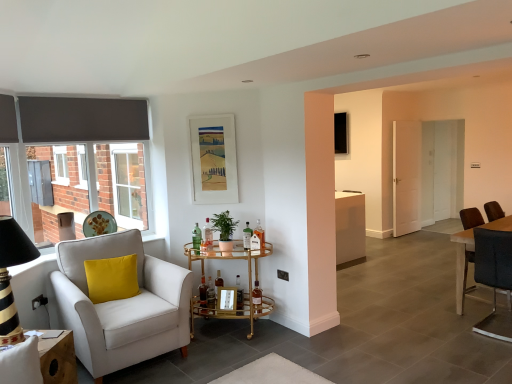
Question: From the image's perspective, is translucent glass bottle at center, the third bottle viewed from the right, below translucent glass bottle at center, marked as the second bottle in a left-to-right arrangement?

Choices:
 (A) no
 (B) yes

Answer: (A)

Question: Is translucent glass bottle at center, positioned as the seventh bottle in left-to-right order, wider than translucent glass bottle at center, the 8th bottle when ordered from right to left?

Choices:
 (A) yes
 (B) no

Answer: (B)

Question: Could you tell me if translucent glass bottle at center, the third bottle viewed from the right, is facing translucent glass bottle at center, marked as the second bottle in a left-to-right arrangement?

Choices:
 (A) yes
 (B) no

Answer: (B)

Question: Can you confirm if translucent glass bottle at center, the third bottle viewed from the right, is thinner than translucent glass bottle at center, marked as the second bottle in a left-to-right arrangement?

Choices:
 (A) yes
 (B) no

Answer: (A)

Question: Is translucent glass bottle at center, the third bottle viewed from the right, positioned before translucent glass bottle at center, marked as the second bottle in a left-to-right arrangement?

Choices:
 (A) yes
 (B) no

Answer: (A)

Question: Considering the positions of black plastic power outlet at lower left, placed as the first power outlet when sorted from top to bottom, and striped wood lampshade at left in the image, is black plastic power outlet at lower left, placed as the first power outlet when sorted from top to bottom, bigger or smaller than striped wood lampshade at left?

Choices:
 (A) big
 (B) small

Answer: (B)

Question: From a real-world perspective, relative to striped wood lampshade at left, is black plastic power outlet at lower left, the 2th power outlet positioned from the left, vertically above or below?

Choices:
 (A) below
 (B) above

Answer: (A)

Question: Looking at their shapes, would you say black plastic power outlet at lower left, the 1th power outlet when ordered from right to left, is wider or thinner than striped wood lampshade at left?

Choices:
 (A) thin
 (B) wide

Answer: (A)

Question: Is black plastic power outlet at lower left, the second power outlet in the bottom-to-top sequence, taller or shorter than striped wood lampshade at left?

Choices:
 (A) short
 (B) tall

Answer: (A)

Question: Looking at their shapes, would you say yellow velvet pillow at left is wider or thinner than black glossy picture frame at upper center, which ranks as the 2th picture frame in front-to-back order?

Choices:
 (A) thin
 (B) wide

Answer: (B)

Question: From the image's perspective, is yellow velvet pillow at left positioned above or below black glossy picture frame at upper center, the 2th picture frame in the bottom-to-top sequence?

Choices:
 (A) above
 (B) below

Answer: (B)

Question: Visually, is yellow velvet pillow at left positioned to the left or to the right of black glossy picture frame at upper center, the 2th picture frame in the bottom-to-top sequence?

Choices:
 (A) left
 (B) right

Answer: (A)

Question: Is yellow velvet pillow at left spatially inside black glossy picture frame at upper center, marked as the 1th picture frame in a right-to-left arrangement, or outside of it?

Choices:
 (A) outside
 (B) inside

Answer: (A)

Question: Considering the positions of translucent glass bottle at center, which appears as the 2th bottle when viewed from the right, and matte paper picture frame at upper center, the 1th picture frame viewed from the front, in the image, is translucent glass bottle at center, which appears as the 2th bottle when viewed from the right, taller or shorter than matte paper picture frame at upper center, the 1th picture frame viewed from the front,?

Choices:
 (A) tall
 (B) short

Answer: (B)

Question: In terms of width, does translucent glass bottle at center, placed as the 8th bottle when sorted from left to right, look wider or thinner when compared to matte paper picture frame at upper center, the 2th picture frame in the back-to-front sequence?

Choices:
 (A) thin
 (B) wide

Answer: (B)